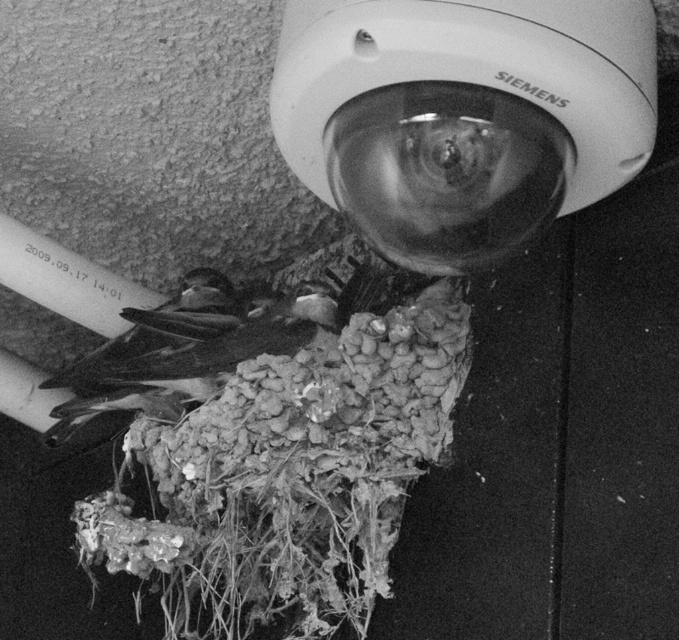
Can you confirm if fuzzy organic nest at lower center is positioned to the left of dark brown feathers at center?

No, fuzzy organic nest at lower center is not to the left of dark brown feathers at center.

Is point (384, 435) farther from camera compared to point (219, 284)?

That is False.

Where is `fuzzy organic nest at lower center`? This screenshot has height=640, width=679. fuzzy organic nest at lower center is located at coordinates (289, 476).

Identify the location of fuzzy organic nest at lower center. (289, 476).